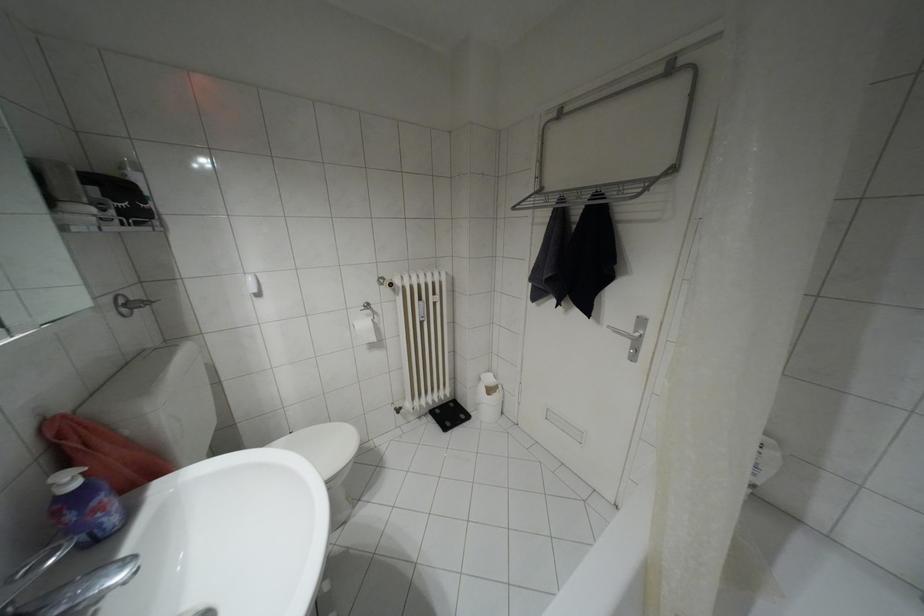
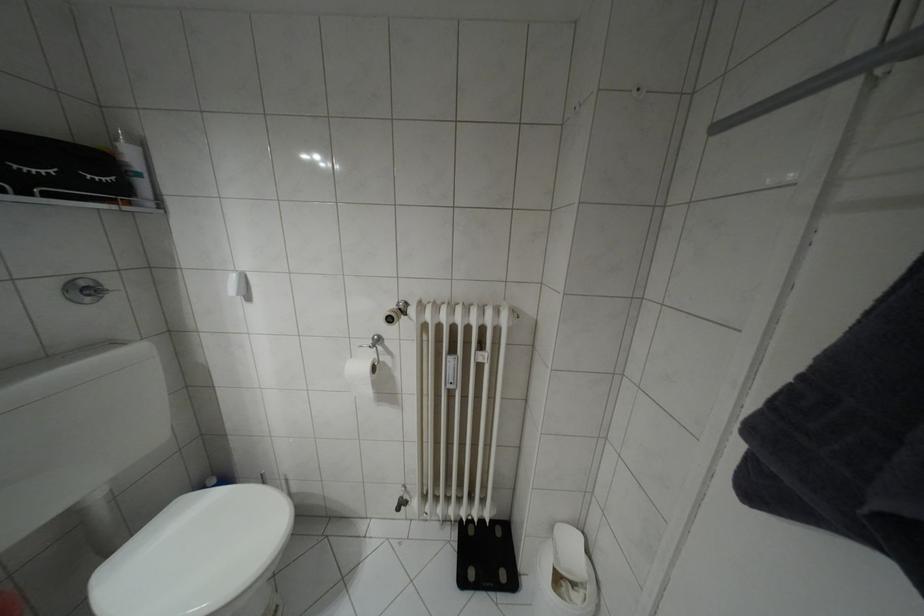
Where in the second image is the point corresponding to (372,338) from the first image?

(369, 392)